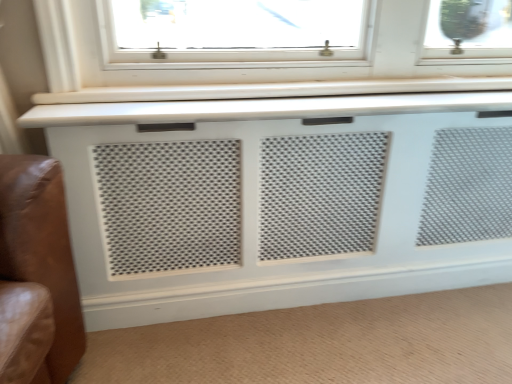
What are the coordinates of `empty space that is ontop of white perforated panel at lower center` in the screenshot? It's located at (323, 334).